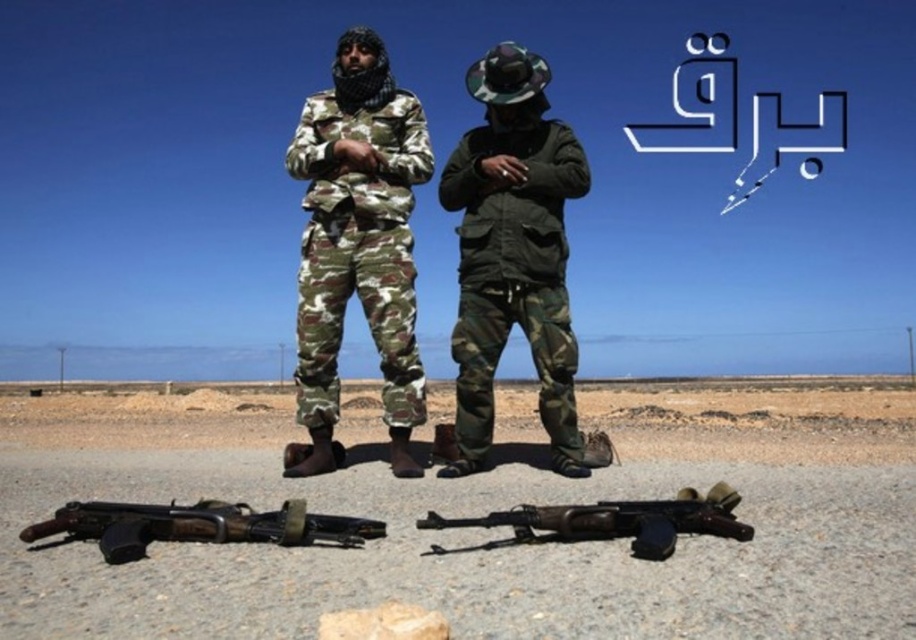
Between point (129, 570) and point (372, 157), which one is positioned in front?

Point (129, 570) is more forward.

Can you confirm if dull gray gravel at center is bigger than camo fabric uniform at center?

Yes.

Find the location of a particular element. The height and width of the screenshot is (640, 916). dull gray gravel at center is located at coordinates (476, 515).

Is dark green matte jacket at center behind matte black rifle at lower center?

That is True.

Who is more distant from viewer, [475,468] or [344,538]?

The point [475,468] is behind.

At what (x,y) coordinates should I click in order to perform the action: click on dark green matte jacket at center. Please return your answer as a coordinate pair (x, y). This screenshot has height=640, width=916. Looking at the image, I should click on (513, 253).

Does camo fabric uniform at center appear over dark green matte jacket at center?

Yes.

This screenshot has width=916, height=640. Describe the element at coordinates (358, 244) in the screenshot. I see `camo fabric uniform at center` at that location.

This screenshot has width=916, height=640. I want to click on camo fabric uniform at center, so click(358, 244).